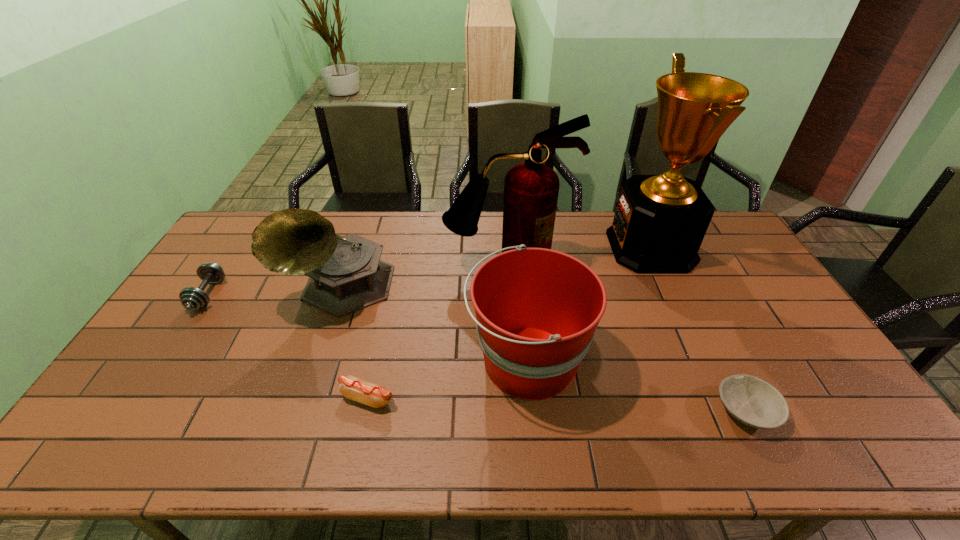
Find the location of `blank region between the shortest object and the bucket`. blank region between the shortest object and the bucket is located at coordinates (636, 386).

You are a GUI agent. You are given a task and a screenshot of the screen. Output one action in this format:
    pyautogui.click(x=<x>, y=<y>)
    Task: Click on the free spot between the trophy cup and the dumbbell
    
    Given the screenshot: What is the action you would take?
    pyautogui.click(x=429, y=271)

You are a GUI agent. You are given a task and a screenshot of the screen. Output one action in this format:
    pyautogui.click(x=<x>, y=<y>)
    Task: Click on the object that is the closest to the trophy cup
    The image size is (960, 540).
    Given the screenshot: What is the action you would take?
    pyautogui.click(x=531, y=189)

Locate an element on the screen. object that can be found as the second closest to the fire extinguisher is located at coordinates coord(345,273).

Where is `free space that satisfies the following two spatial constraints: 1. on the horn direction of the bowl; 2. on the left side of the phonograph record`? The height and width of the screenshot is (540, 960). free space that satisfies the following two spatial constraints: 1. on the horn direction of the bowl; 2. on the left side of the phonograph record is located at coordinates (300, 410).

Where is `free location that satisfies the following two spatial constraints: 1. on the front of the trophy cup with the label; 2. on the horn direction of the phonograph record`? This screenshot has width=960, height=540. free location that satisfies the following two spatial constraints: 1. on the front of the trophy cup with the label; 2. on the horn direction of the phonograph record is located at coordinates (669, 287).

You are a GUI agent. You are given a task and a screenshot of the screen. Output one action in this format:
    pyautogui.click(x=<x>, y=<y>)
    Task: Click on the vacant region that satisfies the following two spatial constraints: 1. on the horn direction of the phonograph record; 2. on the right side of the sausage
    
    Given the screenshot: What is the action you would take?
    pyautogui.click(x=303, y=398)

At what (x,y) coordinates should I click in order to perform the action: click on free space that satisfies the following two spatial constraints: 1. at the nozzle of the bowl; 2. on the right side of the fire extinguisher. Please return your answer as a coordinate pair (x, y). The image size is (960, 540). Looking at the image, I should click on (517, 410).

Locate an element on the screen. The width and height of the screenshot is (960, 540). vacant region that satisfies the following two spatial constraints: 1. on the front of the trophy cup with the label; 2. on the back side of the bowl is located at coordinates (726, 410).

The height and width of the screenshot is (540, 960). Find the location of `free space that satisfies the following two spatial constraints: 1. on the front of the shortest object with the label; 2. on the left side of the trophy cup`. free space that satisfies the following two spatial constraints: 1. on the front of the shortest object with the label; 2. on the left side of the trophy cup is located at coordinates (726, 410).